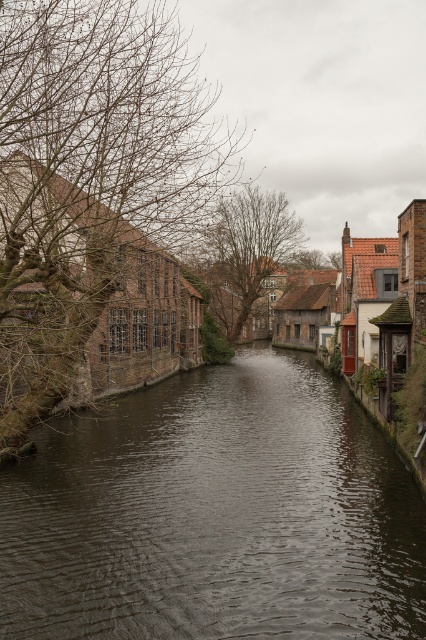
Question: Estimate the real-world distances between objects in this image. Which object is closer to the dark brown water at center?

Choices:
 (A) bare branches at left
 (B) brown leafless tree at center

Answer: (A)

Question: Can you confirm if dark brown water at center is positioned below brown leafless tree at center?

Choices:
 (A) no
 (B) yes

Answer: (B)

Question: Observing the image, what is the correct spatial positioning of bare branches at left in reference to brown leafless tree at center?

Choices:
 (A) right
 (B) left

Answer: (B)

Question: Observing the image, what is the correct spatial positioning of dark brown water at center in reference to bare branches at left?

Choices:
 (A) left
 (B) right

Answer: (B)

Question: Which point is closer to the camera?

Choices:
 (A) brown leafless tree at center
 (B) bare branches at left
 (C) dark brown water at center

Answer: (C)

Question: Which object is farther from the camera taking this photo?

Choices:
 (A) bare branches at left
 (B) dark brown water at center

Answer: (A)